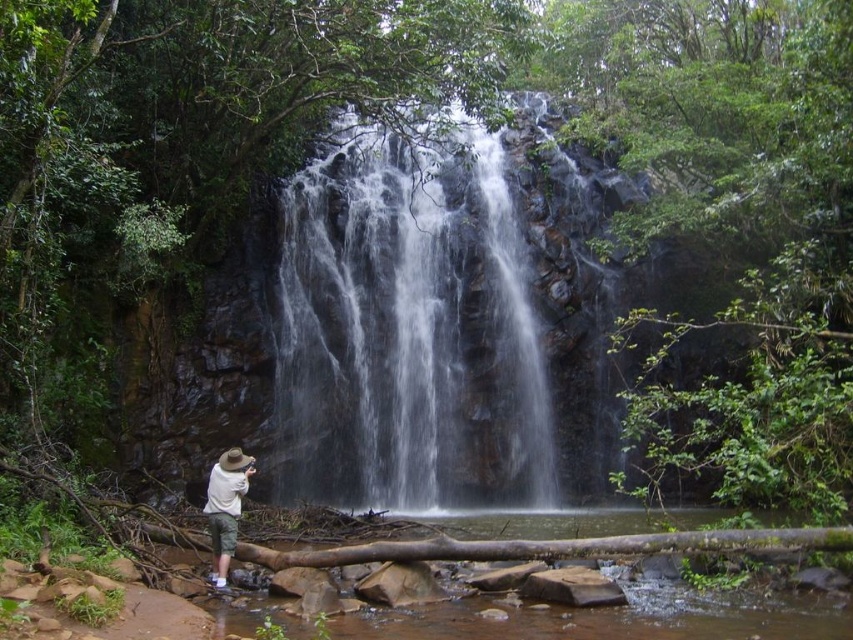
Question: Which object is farther from the camera taking this photo?

Choices:
 (A) white cotton shirt at lower left
 (B) clear water at center

Answer: (B)

Question: Does clear water at center have a larger size compared to white cotton shirt at lower left?

Choices:
 (A) yes
 (B) no

Answer: (A)

Question: Is clear water at center positioned before white cotton shirt at lower left?

Choices:
 (A) yes
 (B) no

Answer: (B)

Question: Among these objects, which one is farthest from the camera?

Choices:
 (A) white cotton shirt at lower left
 (B) clear water at center

Answer: (B)

Question: Can you confirm if clear water at center is positioned above white cotton shirt at lower left?

Choices:
 (A) yes
 (B) no

Answer: (A)